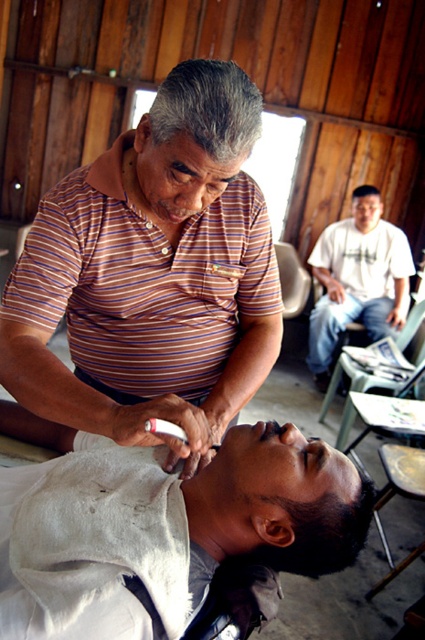
Question: Is the position of striped cotton shirt at center more distant than that of white cloth at lower center?

Choices:
 (A) yes
 (B) no

Answer: (A)

Question: Which point is closer to the camera?

Choices:
 (A) (346, 529)
 (B) (340, 442)
 (C) (47, 332)

Answer: (A)

Question: Which point is farther to the camera?

Choices:
 (A) (371, 253)
 (B) (368, 376)

Answer: (A)

Question: Estimate the real-world distances between objects in this image. Which object is farther from the metallic gray chair at center?

Choices:
 (A) white cotton shirt at upper right
 (B) white cloth at lower center

Answer: (B)

Question: Is striped cotton shirt at center thinner than metallic gray chair at center?

Choices:
 (A) yes
 (B) no

Answer: (B)

Question: Does white cotton shirt at upper right have a lesser width compared to metallic gray chair at center?

Choices:
 (A) yes
 (B) no

Answer: (B)